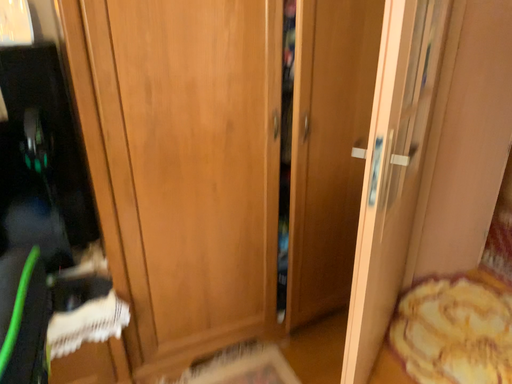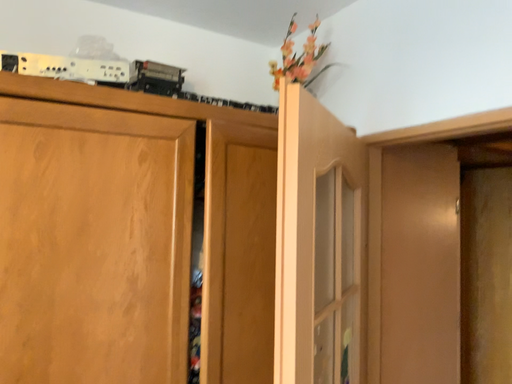
Question: Which way did the camera rotate in the video?

Choices:
 (A) rotated upward
 (B) rotated downward

Answer: (A)